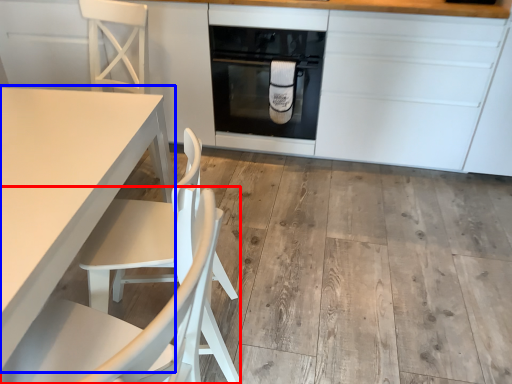
Question: Which object appears farthest to the camera in this image, chair (highlighted by a red box) or table (highlighted by a blue box)?

Choices:
 (A) chair
 (B) table

Answer: (B)